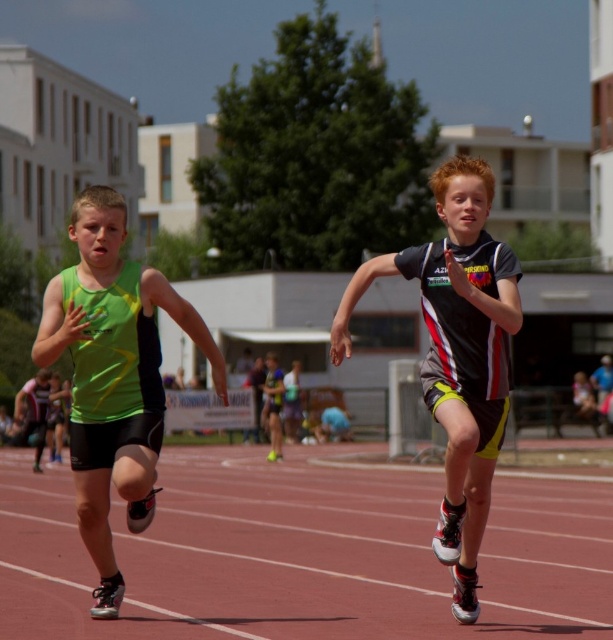
You are a photographer positioned at the starting line of the race. You want to capture a photo that includes both the green matte tank top at left and the black and white jersey at center. Given that your camera has a maximum focus range of 2.5 meters, will you be able to capture both subjects in focus?

The green matte tank top at left and the black and white jersey at center are 2.48 meters apart from each other. Since the distance between them is within the camera maximum focus range of 2.5 meters, both subjects can be captured in focus.

You are a photographer at the track event. You want to capture a photo where both the rubberized red track at center and the green matte tank top at left are clearly visible. Considering their sizes, which object should you focus on first to ensure it appears sharp in the photo?

The rubberized red track at center is larger in size than the green matte tank top at left, so you should focus on the rubberized red track at center first to ensure it appears sharp in the photo.

You are a photographer trying to capture a closeup of the black and white jersey at center while ensuring the rubberized red track at center is visible in the background. Given their sizes, will you need to adjust your camera settings to focus on the jersey first before the track?

The rubberized red track at center is bigger than the black and white jersey at center. To focus on the smaller black and white jersey at center while keeping the larger rubberized red track at center in the background, adjust your camera settings to ensure proper focus on the jersey first.